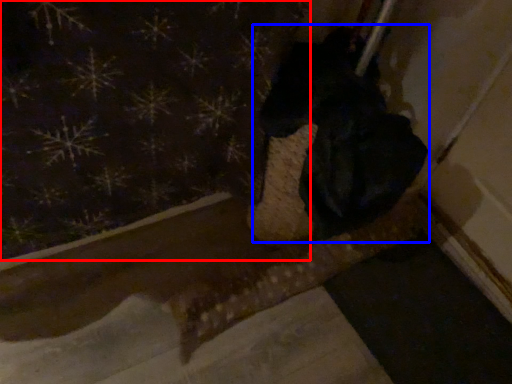
Question: Which point is further to the camera, curtain (highlighted by a red box) or animal (highlighted by a blue box)?

Choices:
 (A) curtain
 (B) animal

Answer: (B)